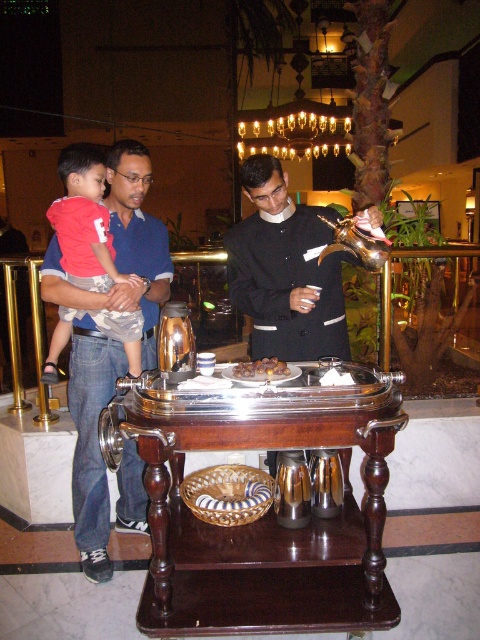
Question: Which point is farther to the camera?

Choices:
 (A) (343, 320)
 (B) (51, 364)
 (C) (236, 365)
 (D) (314, 541)

Answer: (B)

Question: Among these points, which one is nearest to the camera?

Choices:
 (A) (313, 524)
 (B) (275, 365)

Answer: (B)

Question: Is shiny dark wood buffet at center to the left of brown glossy nuts at center from the viewer's perspective?

Choices:
 (A) no
 (B) yes

Answer: (B)

Question: Is blue denim jeans at left to the left of shiny black uniform at center from the viewer's perspective?

Choices:
 (A) yes
 (B) no

Answer: (A)

Question: Based on their relative distances, which object is nearer to the shiny dark wood buffet at center?

Choices:
 (A) matte red shirt at left
 (B) brown glossy nuts at center

Answer: (B)

Question: Can you confirm if blue denim jeans at left is positioned above shiny black uniform at center?

Choices:
 (A) yes
 (B) no

Answer: (B)